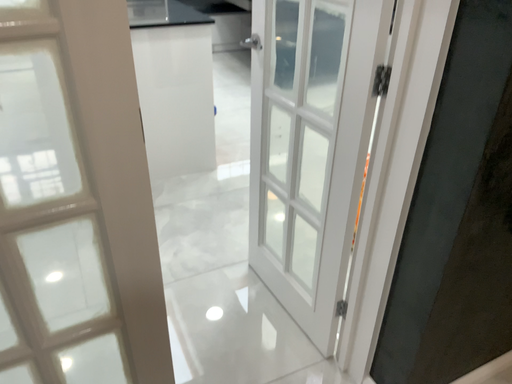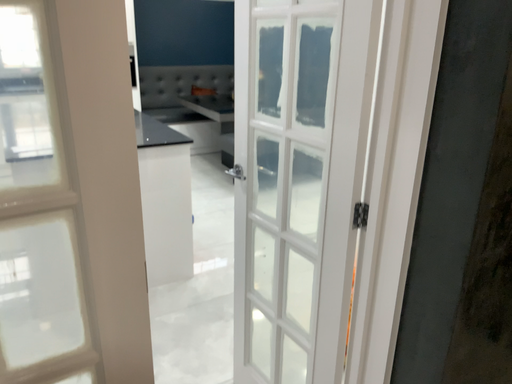
Question: How did the camera likely rotate when shooting the video?

Choices:
 (A) rotated upward
 (B) rotated downward

Answer: (A)